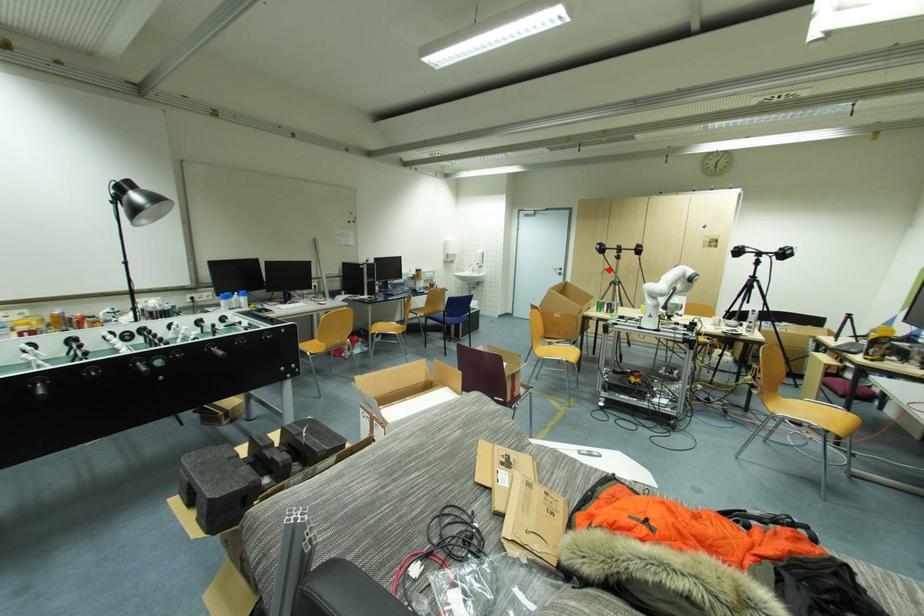
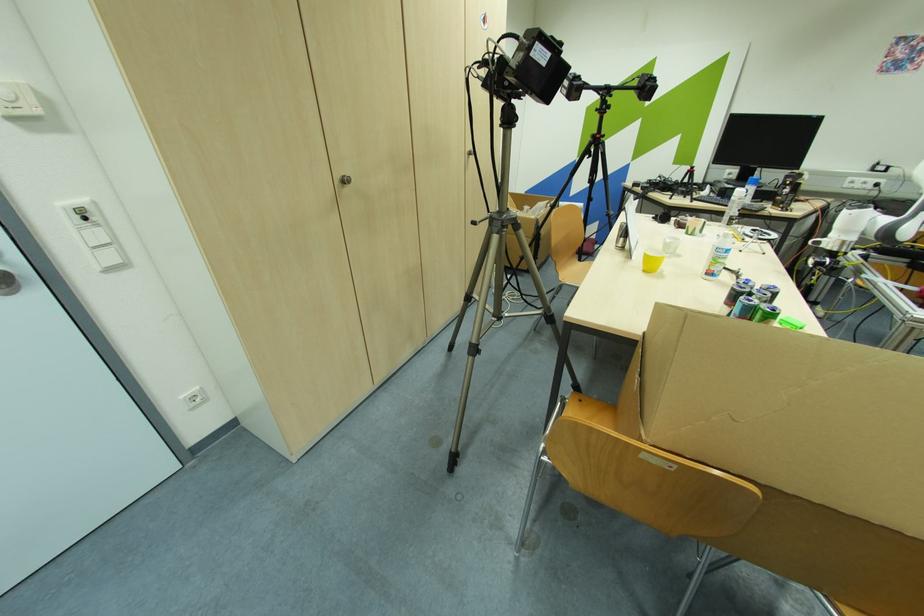
Question: I am providing you with two images of the same scene from different viewpoints. In image1, a red point is highlighted. Considering the same 3D point in image2, which of the following is correct?

Choices:
 (A) It is closer
 (B) It is farther

Answer: (B)